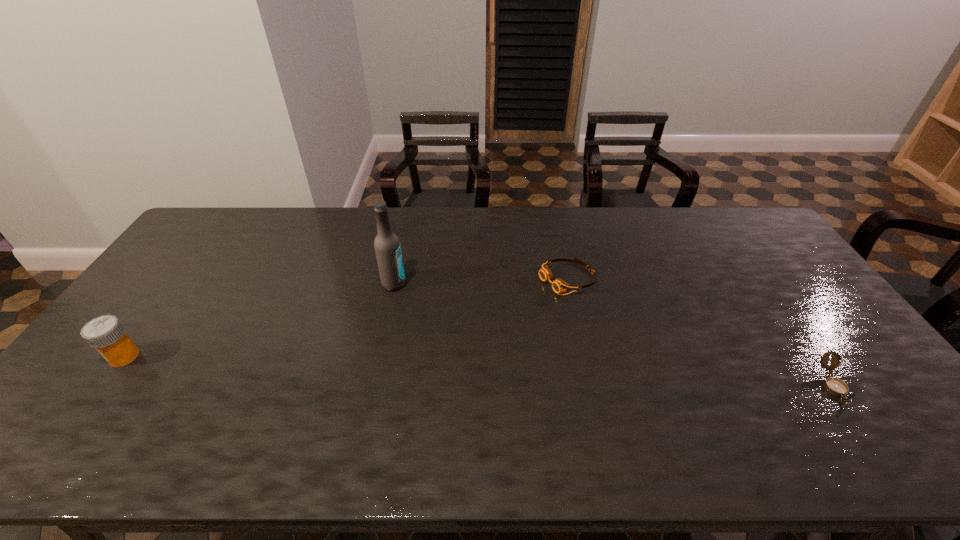
Where is `free spot on the desktop that is between the medicine and the compass and is positioned with the lenses facing forward on the second object from right to left`? The image size is (960, 540). free spot on the desktop that is between the medicine and the compass and is positioned with the lenses facing forward on the second object from right to left is located at coordinates (379, 367).

Where is `vacant spot on the desktop that is between the medicine and the compass and is positioned on the label of the beer bottle`? vacant spot on the desktop that is between the medicine and the compass and is positioned on the label of the beer bottle is located at coordinates (550, 374).